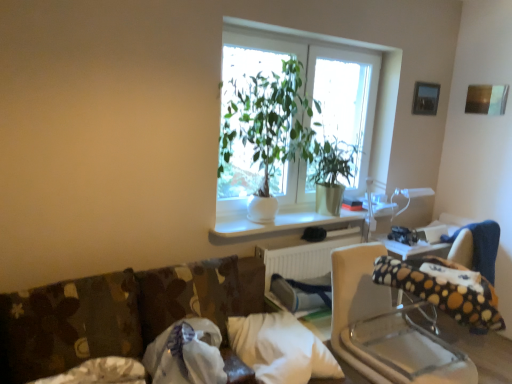
Question: Does polka dot fabric bean bag chair at right appear on the left side of white soft pillow at lower center, which appears as the 1th pillow when viewed from the right?

Choices:
 (A) no
 (B) yes

Answer: (A)

Question: Does polka dot fabric bean bag chair at right have a smaller size compared to white soft pillow at lower center, the 3th pillow viewed from the left?

Choices:
 (A) yes
 (B) no

Answer: (B)

Question: Are polka dot fabric bean bag chair at right and white soft pillow at lower center, the 3th pillow viewed from the left, beside each other?

Choices:
 (A) yes
 (B) no

Answer: (B)

Question: Is polka dot fabric bean bag chair at right positioned with its back to white soft pillow at lower center, the 3th pillow viewed from the left?

Choices:
 (A) no
 (B) yes

Answer: (A)

Question: From a real-world perspective, is polka dot fabric bean bag chair at right located higher than white soft pillow at lower center, the 3th pillow viewed from the left?

Choices:
 (A) no
 (B) yes

Answer: (B)

Question: In the image, is green glossy plant at center positioned in front of or behind metallic silver picture frame at upper right?

Choices:
 (A) behind
 (B) front

Answer: (B)

Question: Is green glossy plant at center wider or thinner than metallic silver picture frame at upper right?

Choices:
 (A) wide
 (B) thin

Answer: (A)

Question: Considering the positions of green glossy plant at center and metallic silver picture frame at upper right in the image, is green glossy plant at center taller or shorter than metallic silver picture frame at upper right?

Choices:
 (A) short
 (B) tall

Answer: (B)

Question: From the image's perspective, is green glossy plant at center above or below metallic silver picture frame at upper right?

Choices:
 (A) above
 (B) below

Answer: (B)

Question: Do you think polka dot fabric rocking chair at center is within brown floral fabric pillow at lower left, arranged as the first pillow when viewed from the left, or outside of it?

Choices:
 (A) inside
 (B) outside

Answer: (B)

Question: Considering the relative positions of polka dot fabric rocking chair at center and brown floral fabric pillow at lower left, arranged as the first pillow when viewed from the left, in the image provided, is polka dot fabric rocking chair at center to the left or to the right of brown floral fabric pillow at lower left, arranged as the first pillow when viewed from the left,?

Choices:
 (A) right
 (B) left

Answer: (A)

Question: Is point (350, 344) closer or farther from the camera than point (19, 382)?

Choices:
 (A) farther
 (B) closer

Answer: (A)

Question: From a real-world perspective, is polka dot fabric rocking chair at center physically located above or below brown floral fabric pillow at lower left, arranged as the first pillow when viewed from the left?

Choices:
 (A) below
 (B) above

Answer: (A)

Question: Does point (346, 216) appear closer or farther from the camera than point (223, 170)?

Choices:
 (A) closer
 (B) farther

Answer: (B)

Question: Is white matte window sill at center taller or shorter than green glossy plant at center?

Choices:
 (A) tall
 (B) short

Answer: (B)